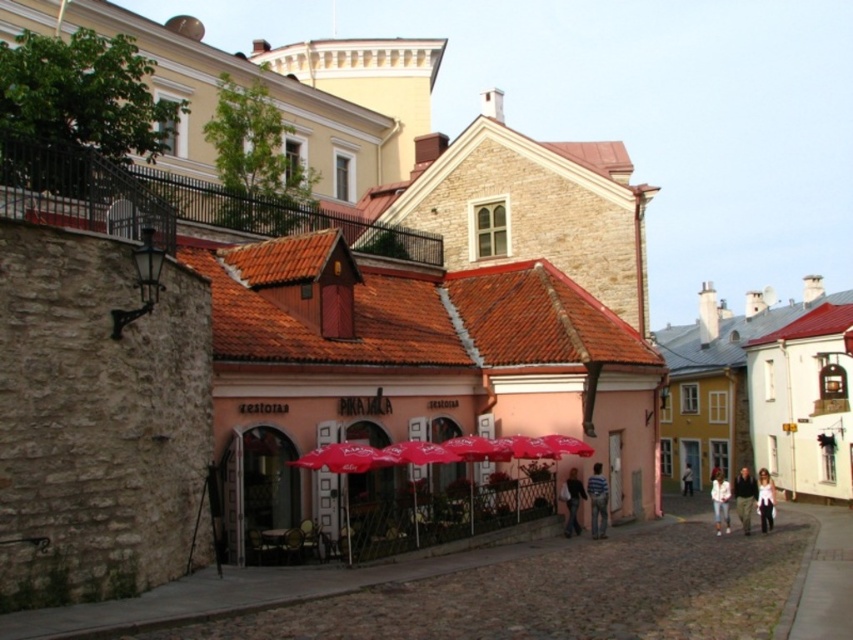
You are a tourist standing in front of the Pika Jala cafe. You see the red fabric umbrella at center and the dark blue jeans at center. Which object is located more to the left?

The red fabric umbrella at center is positioned on the left side of dark blue jeans at center, so it is more to the left.

You are a tailor who needs to determine which garment is more suitable for a customer who requires a taller garment. Based on the scene, which one would you recommend between the dark gray fabric jacket at center and the light pink fabric coat at lower right?

The dark gray fabric jacket at center is much taller than the light pink fabric coat at lower right, so it is more suitable for a customer requiring a taller garment.

You are a tourist standing in front of the Pika Jala cafe. You have a pair of dark blue jeans at center that you want to dry under the red fabric umbrella at center. Can the umbrella accommodate the height of your jeans?

The red fabric umbrella at center is much taller than dark blue jeans at center, so yes, the umbrella can accommodate the height of the dark blue jeans at center.